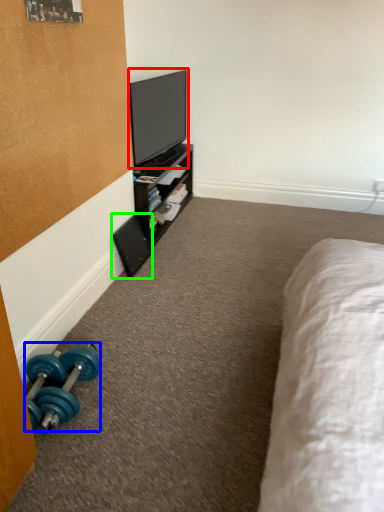
Question: Based on their relative distances, which object is nearer to television (highlighted by a red box)? Choose from dumbbell (highlighted by a blue box) and speaker (highlighted by a green box).

Choices:
 (A) dumbbell
 (B) speaker

Answer: (B)